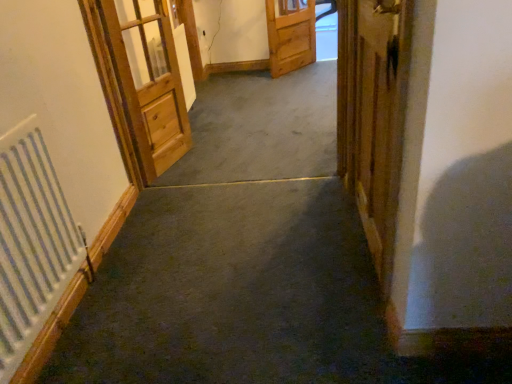
Image resolution: width=512 pixels, height=384 pixels. Describe the element at coordinates (290, 35) in the screenshot. I see `wooden door at center, placed as the second door when sorted from right to left` at that location.

Image resolution: width=512 pixels, height=384 pixels. What are the coordinates of `wooden drawer at center` in the screenshot? It's located at (294, 40).

Measure the distance between white metallic radiator at left and camera.

3.89 feet.

At what (x,y) coordinates should I click in order to perform the action: click on light brown wooden door at left, marked as the second door in a back-to-front arrangement. Please return your answer as a coordinate pair (x, y). Looking at the image, I should click on (148, 80).

Describe the element at coordinates (373, 115) in the screenshot. The image size is (512, 384). I see `wooden door at right, placed as the first door when sorted from front to back` at that location.

In order to face wooden door at right, acting as the 1th door starting from the right, should I rotate leftwards or rightwards?

To align with it, rotate right about 14.373°.

You are a GUI agent. You are given a task and a screenshot of the screen. Output one action in this format:
    pyautogui.click(x=<x>, y=<y>)
    Task: Click on the wooden door at center, positioned as the 1th door in back-to-front order
    
    Given the screenshot: What is the action you would take?
    pyautogui.click(x=290, y=35)

How different are the orientations of wooden drawer at center and light brown wooden door at left, marked as the second door in a back-to-front arrangement, in degrees?

71.2 degrees separate the facing orientations of wooden drawer at center and light brown wooden door at left, marked as the second door in a back-to-front arrangement.

Who is smaller, wooden drawer at center or light brown wooden door at left, arranged as the second door when viewed from the front?

With smaller size is wooden drawer at center.

Which door is the 3rd one when counting from the left side of the wooden drawer at center? Please provide its 2D coordinates.

[(148, 80)]

Would you consider wooden drawer at center to be distant from light brown wooden door at left, marked as the second door in a back-to-front arrangement?

Yes, wooden drawer at center and light brown wooden door at left, marked as the second door in a back-to-front arrangement, are located far from each other.

Between light brown wooden door at left, which ranks as the 3th door in right-to-left order, and wooden door at right, the third door in the left-to-right sequence, which one is positioned in front?

wooden door at right, the third door in the left-to-right sequence, is closer to the camera.

In terms of width, does light brown wooden door at left, arranged as the second door when viewed from the front, look wider or thinner when compared to wooden door at right, placed as the first door when sorted from front to back?

Considering their sizes, light brown wooden door at left, arranged as the second door when viewed from the front, looks broader than wooden door at right, placed as the first door when sorted from front to back.

From a real-world perspective, is light brown wooden door at left, arranged as the second door when viewed from the front, below wooden door at right, placed as the first door when sorted from front to back?

No, from a real-world perspective, light brown wooden door at left, arranged as the second door when viewed from the front, is not beneath wooden door at right, placed as the first door when sorted from front to back.

Is light brown wooden door at left, the 1th door viewed from the left, not inside wooden door at right, acting as the 1th door starting from the right?

Yes, light brown wooden door at left, the 1th door viewed from the left, is located beyond the bounds of wooden door at right, acting as the 1th door starting from the right.

Which object is further away from the camera, wooden drawer at center or white metallic radiator at left?

wooden drawer at center is further from the camera.

Can you confirm if wooden drawer at center is taller than white metallic radiator at left?

In fact, wooden drawer at center may be shorter than white metallic radiator at left.

From the image's perspective, is wooden drawer at center positioned above or below white metallic radiator at left?

Based on their image positions, wooden drawer at center is located above white metallic radiator at left.

Is wooden drawer at center positioned before wooden door at center, placed as the second door when sorted from right to left?

No, wooden drawer at center is further to the viewer.

Does wooden drawer at center appear on the right side of wooden door at center, placed as the second door when sorted from right to left?

Indeed, wooden drawer at center is positioned on the right side of wooden door at center, placed as the second door when sorted from right to left.

From the image's perspective, which object appears higher, wooden drawer at center or wooden door at center, positioned as the 1th door in back-to-front order?

wooden drawer at center, from the image's perspective.

Are wooden drawer at center and wooden door at center, positioned as the 1th door in back-to-front order, beside each other?

Absolutely, wooden drawer at center is next to and touching wooden door at center, positioned as the 1th door in back-to-front order.

This screenshot has width=512, height=384. I want to click on the 2nd door to the left when counting from the wooden door at right, acting as the 1th door starting from the right, so click(x=148, y=80).

How different are the orientations of wooden door at right, placed as the first door when sorted from front to back, and light brown wooden door at left, the 1th door viewed from the left, in degrees?

162 degrees.

Is wooden door at right, acting as the 1th door starting from the right, further to the viewer compared to light brown wooden door at left, marked as the second door in a back-to-front arrangement?

No, it is not.

From the picture: Does wooden door at right, acting as the 1th door starting from the right, contain light brown wooden door at left, which ranks as the 3th door in right-to-left order?

No, light brown wooden door at left, which ranks as the 3th door in right-to-left order, is located outside of wooden door at right, acting as the 1th door starting from the right.

Looking at this image, how many degrees apart are the facing directions of wooden door at center, placed as the second door when sorted from right to left, and white metallic radiator at left?

They differ by 42.8 degrees in their facing directions.

Considering the positions of objects wooden door at center, marked as the 3th door in a front-to-back arrangement, and white metallic radiator at left in the image provided, who is in front, wooden door at center, marked as the 3th door in a front-to-back arrangement, or white metallic radiator at left?

Positioned in front is white metallic radiator at left.

Between wooden door at center, placed as the second door when sorted from right to left, and white metallic radiator at left, which one has less height?

Standing shorter between the two is white metallic radiator at left.

Is wooden door at center, positioned as the 1th door in back-to-front order, turned away from white metallic radiator at left?

wooden door at center, positioned as the 1th door in back-to-front order, is not turned away from white metallic radiator at left.

From the image's perspective, is white metallic radiator at left located beneath wooden drawer at center?

Yes, from the image's perspective, white metallic radiator at left is below wooden drawer at center.

Does white metallic radiator at left lie behind wooden drawer at center?

No, it is in front of wooden drawer at center.

Considering the sizes of white metallic radiator at left and wooden drawer at center in the image, is white metallic radiator at left wider or thinner than wooden drawer at center?

Considering their sizes, white metallic radiator at left looks broader than wooden drawer at center.

Would you consider white metallic radiator at left to be distant from wooden drawer at center?

white metallic radiator at left is far away from wooden drawer at center.

The width and height of the screenshot is (512, 384). What are the coordinates of `the 2nd door positioned below the wooden drawer at center (from the image's perspective)` in the screenshot? It's located at (148, 80).

I want to click on door above the wooden door at right, placed as the third door when sorted from back to front (from a real-world perspective), so click(148, 80).

When comparing their distances from wooden door at center, marked as the 3th door in a front-to-back arrangement, does wooden drawer at center or light brown wooden door at left, marked as the second door in a back-to-front arrangement, seem further?

light brown wooden door at left, marked as the second door in a back-to-front arrangement, lies further to wooden door at center, marked as the 3th door in a front-to-back arrangement, than the other object.

Based on their spatial positions, is wooden door at center, marked as the 3th door in a front-to-back arrangement, or light brown wooden door at left, which ranks as the 3th door in right-to-left order, closer to wooden door at right, acting as the 1th door starting from the right?

Based on the image, light brown wooden door at left, which ranks as the 3th door in right-to-left order, appears to be nearer to wooden door at right, acting as the 1th door starting from the right.

When comparing their distances from wooden door at right, acting as the 1th door starting from the right, does white metallic radiator at left or wooden door at center, marked as the 3th door in a front-to-back arrangement, seem closer?

white metallic radiator at left lies closer to wooden door at right, acting as the 1th door starting from the right, than the other object.

Considering their positions, is white metallic radiator at left positioned further to light brown wooden door at left, marked as the second door in a back-to-front arrangement, than wooden door at right, the third door in the left-to-right sequence?

wooden door at right, the third door in the left-to-right sequence, is further to light brown wooden door at left, marked as the second door in a back-to-front arrangement.

In the scene shown: Considering their positions, is light brown wooden door at left, arranged as the second door when viewed from the front, positioned further to white metallic radiator at left than wooden door at right, the third door in the left-to-right sequence?

wooden door at right, the third door in the left-to-right sequence, is positioned further to the anchor white metallic radiator at left.

Estimate the real-world distances between objects in this image. Which object is further from wooden drawer at center, wooden door at right, placed as the first door when sorted from front to back, or wooden door at center, placed as the second door when sorted from right to left?

wooden door at right, placed as the first door when sorted from front to back.

From the image, which object appears to be farther from wooden door at right, acting as the 1th door starting from the right, light brown wooden door at left, marked as the second door in a back-to-front arrangement, or white metallic radiator at left?

The object further to wooden door at right, acting as the 1th door starting from the right, is white metallic radiator at left.

Based on the photo, from the image, which object appears to be farther from wooden door at center, positioned as the 1th door in back-to-front order, white metallic radiator at left or light brown wooden door at left, marked as the second door in a back-to-front arrangement?

Among the two, white metallic radiator at left is located further to wooden door at center, positioned as the 1th door in back-to-front order.

I want to click on door located between light brown wooden door at left, the 1th door viewed from the left, and wooden drawer at center in the depth direction, so click(290, 35).

Where is `door between white metallic radiator at left and light brown wooden door at left, marked as the second door in a back-to-front arrangement, from front to back`? Image resolution: width=512 pixels, height=384 pixels. door between white metallic radiator at left and light brown wooden door at left, marked as the second door in a back-to-front arrangement, from front to back is located at coordinates (373, 115).

Where is `door between wooden door at right, placed as the first door when sorted from front to back, and wooden door at center, placed as the second door when sorted from right to left, in the front-back direction`? door between wooden door at right, placed as the first door when sorted from front to back, and wooden door at center, placed as the second door when sorted from right to left, in the front-back direction is located at coordinates (148, 80).